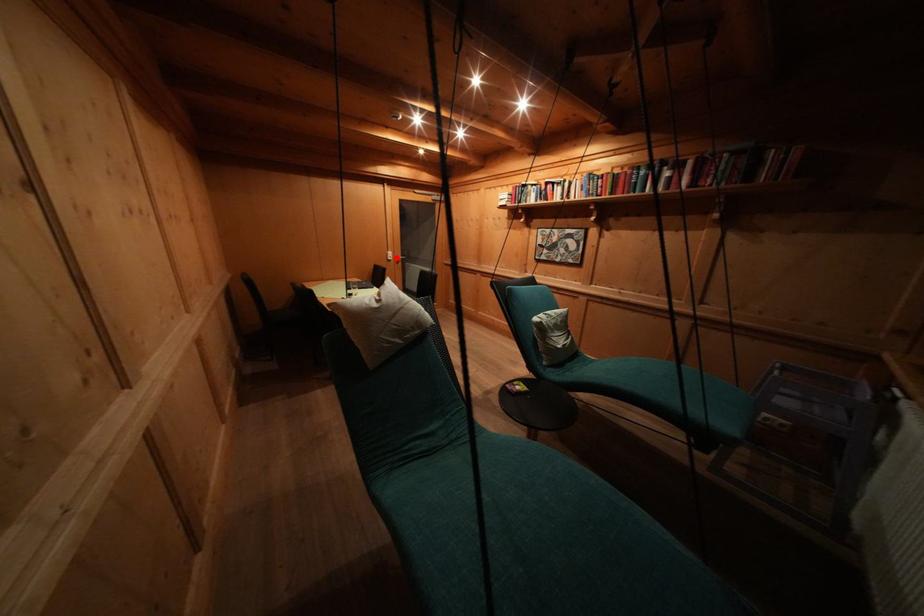
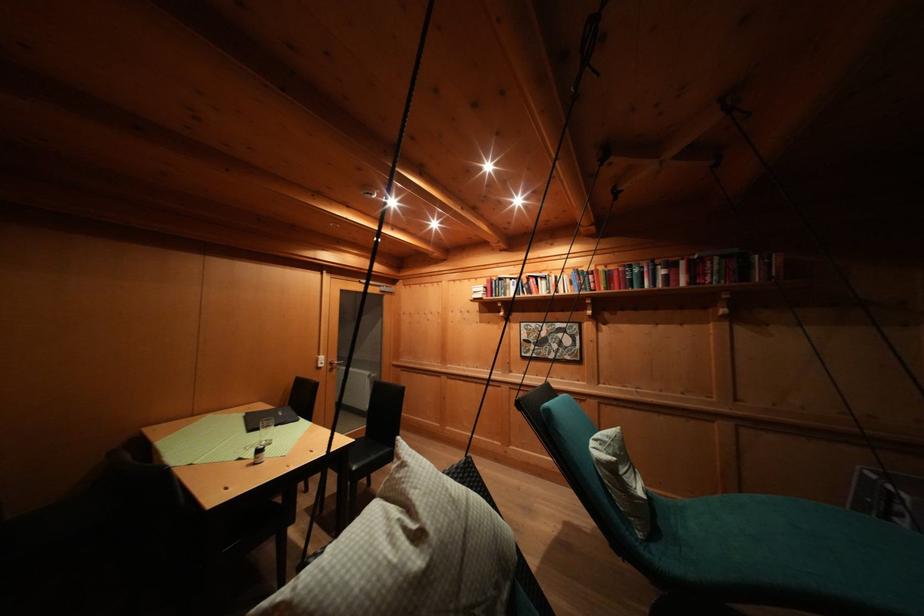
Find the pixel in the second image that matches the highlighted location in the first image.

(327, 362)